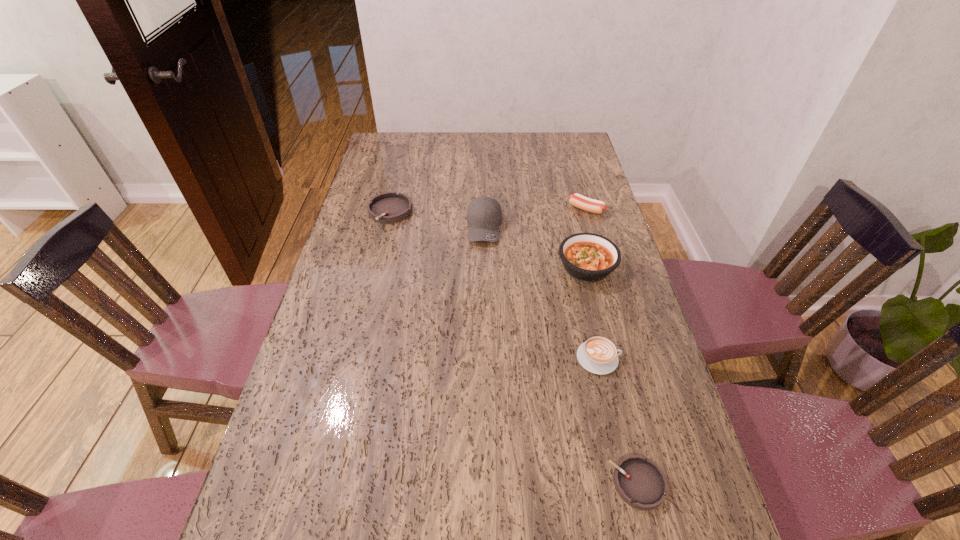
Locate an element on the screen. The height and width of the screenshot is (540, 960). free space that satisfies the following two spatial constraints: 1. on the side of the nearest object with the handle; 2. on the right side of the second nearest object is located at coordinates (627, 483).

In order to click on blank space that satisfies the following two spatial constraints: 1. on the front side of the stew; 2. on the right side of the leftmost object in this screenshot , I will do `click(376, 267)`.

Locate an element on the screen. The height and width of the screenshot is (540, 960). free spot that satisfies the following two spatial constraints: 1. on the front brim of the nearer ashtray; 2. on the right side of the baseball cap is located at coordinates (488, 483).

Identify the location of vacant space that satisfies the following two spatial constraints: 1. on the front brim of the stew; 2. on the left side of the baseball cap. The width and height of the screenshot is (960, 540). (485, 267).